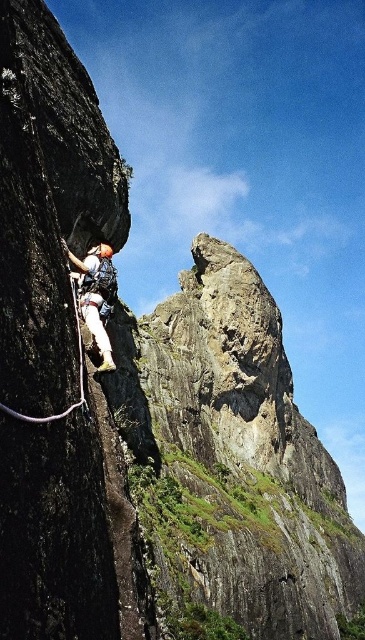
You are a rock climber who has reached a point on the rock face. You notice a white climbing harness at left located at point [95,294]. If you want to move towards the harness, which direction should you move?

The white climbing harness at left is located at point [95,294]. Since it is at the left side, you should move to your left to reach it.

You are a climber trying to reach the top of the rock face. You notice two points on the rock face where you can place your hands. The first point is at coordinates point (79,300) and the second point is at point (75,316). Which point is closer to you so you can grab it first?

Point (79,300) is further to the viewer than point (75,316), so the second point is closer and can be grabbed first.

You are standing at the base of the cliff and see the white climbing harness at left attached to a climber. If you want to throw a rope to the climber, and your throwing range is 50 meters, will you be able to reach them?

The distance between the white climbing harness at left and the viewer is 52.15 meters, which exceeds your throwing range of 50 meters. Therefore, you cannot reach the climber by throwing a rope.